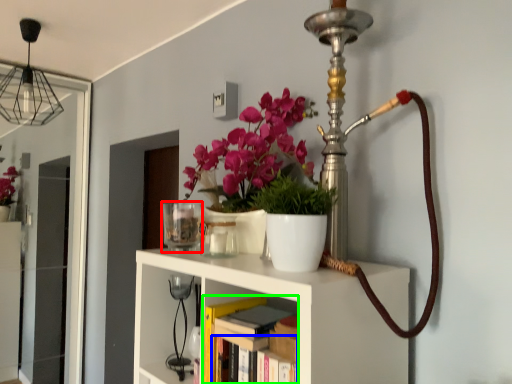
Question: Estimate the real-world distances between objects in this image. Which object is farther from candle holder (highlighted by a red box), book (highlighted by a blue box) or book (highlighted by a green box)?

Choices:
 (A) book
 (B) book

Answer: (A)